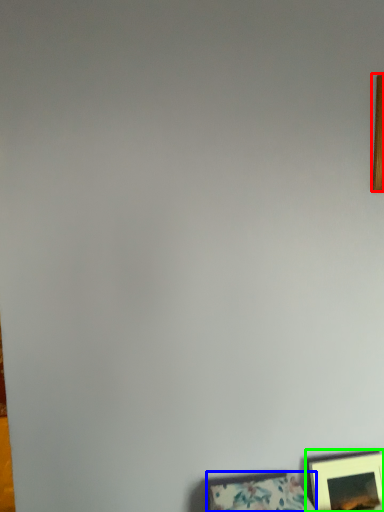
Question: Estimate the real-world distances between objects in this image. Which object is farther from picture frame (highlighted by a red box), picture frame (highlighted by a blue box) or picture frame (highlighted by a green box)?

Choices:
 (A) picture frame
 (B) picture frame

Answer: (A)